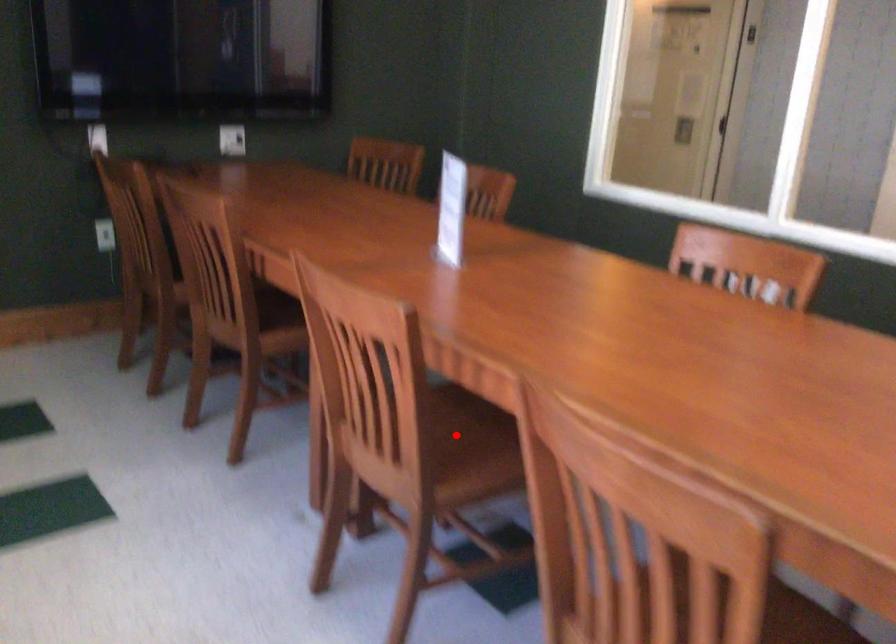
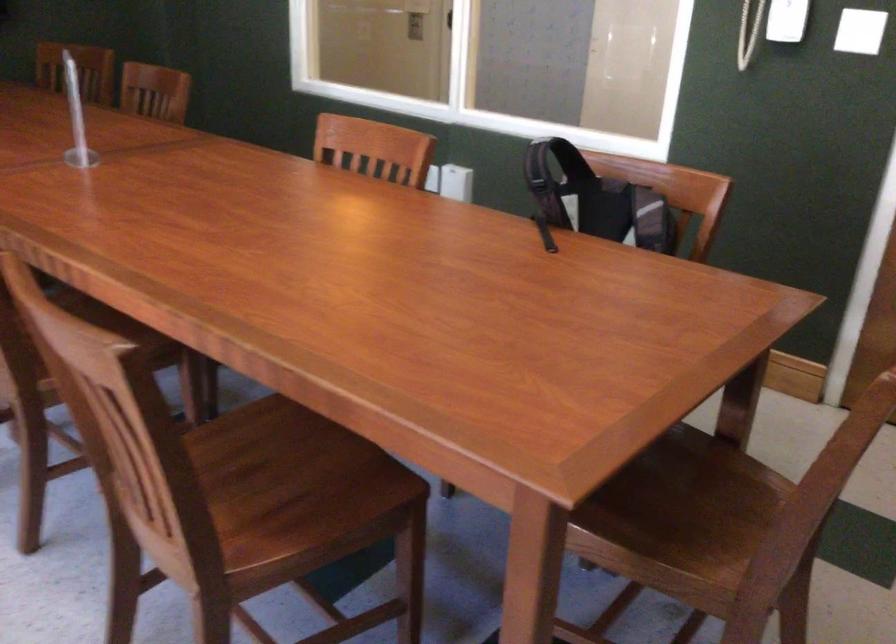
Question: I am providing you with two images of the same scene from different viewpoints. A red point is marked on the first image. Can you still see the location of the red point in image 2?

Choices:
 (A) Yes
 (B) No

Answer: (B)